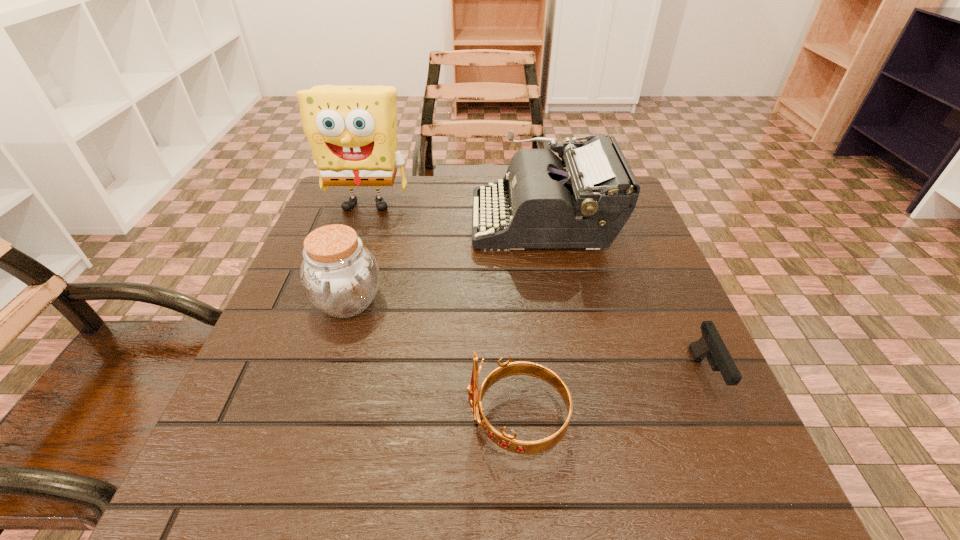
Find the location of a particular element. The image size is (960, 540). typewriter situated at the right edge is located at coordinates (584, 200).

Where is `pistol positioned at the right edge`? This screenshot has height=540, width=960. pistol positioned at the right edge is located at coordinates (711, 346).

Locate an element on the screen. The height and width of the screenshot is (540, 960). object present at the far left corner is located at coordinates (352, 130).

Locate an element on the screen. The height and width of the screenshot is (540, 960). object located in the far right corner section of the desktop is located at coordinates (584, 200).

Find the location of a particular element. The image size is (960, 540). free space at the near edge is located at coordinates (430, 492).

In the image, there is a desktop. Where is `vacant space at the left edge`? Image resolution: width=960 pixels, height=540 pixels. vacant space at the left edge is located at coordinates (304, 341).

The width and height of the screenshot is (960, 540). Find the location of `free space at the right edge of the desktop`. free space at the right edge of the desktop is located at coordinates (692, 403).

Locate an element on the screen. The width and height of the screenshot is (960, 540). vacant space at the far left corner is located at coordinates (348, 214).

You are a GUI agent. You are given a task and a screenshot of the screen. Output one action in this format:
    pyautogui.click(x=<x>, y=<y>)
    Task: Click on the vacant space at the near right corner of the desktop
    Image resolution: width=960 pixels, height=540 pixels.
    Given the screenshot: What is the action you would take?
    click(x=717, y=475)

This screenshot has width=960, height=540. Find the location of `empty location between the tiara and the tallest object`. empty location between the tiara and the tallest object is located at coordinates (443, 312).